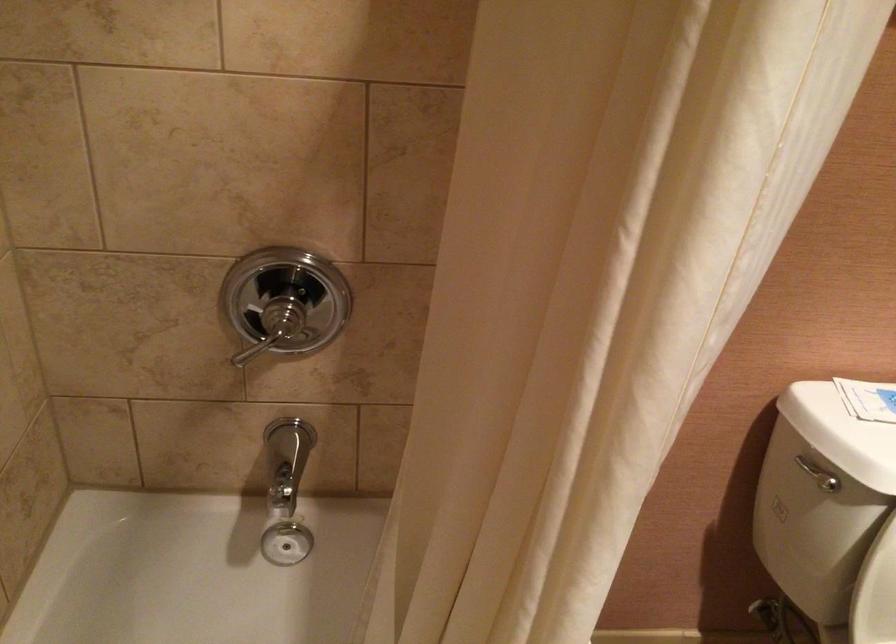
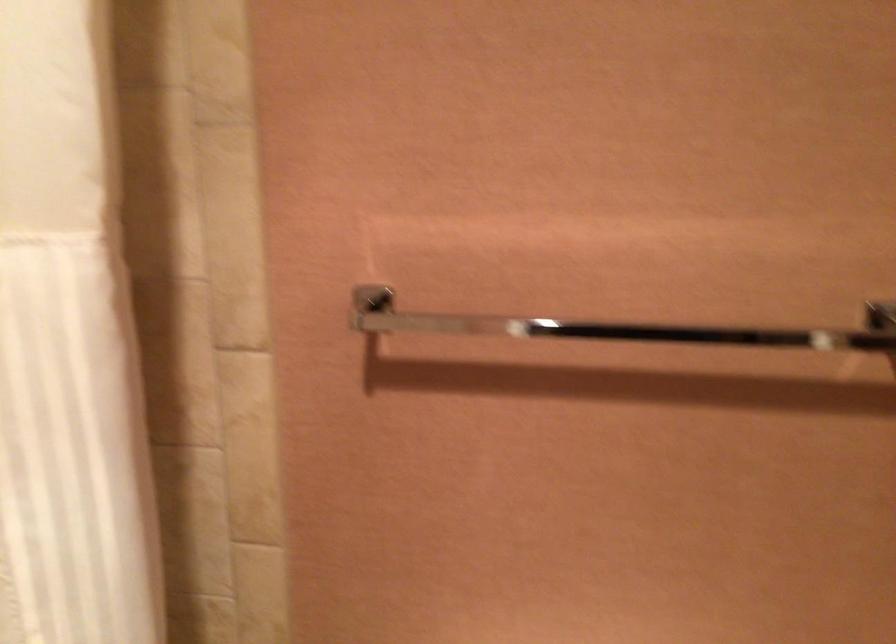
Question: The images are taken continuously from a first-person perspective. In which direction is your viewpoint rotating?

Choices:
 (A) Left
 (B) Right
 (C) Up
 (D) Down

Answer: (C)